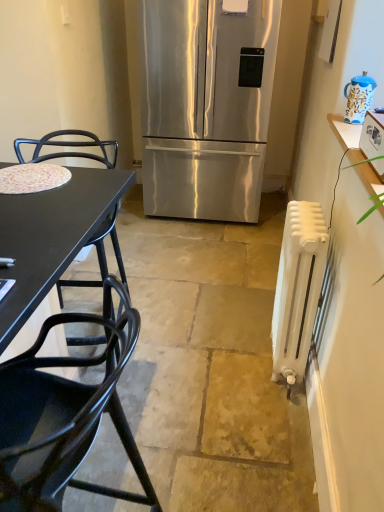
Question: Is white plastic toaster at upper right smaller than stainless steel refrigerator at center?

Choices:
 (A) yes
 (B) no

Answer: (A)

Question: Is there a large distance between white plastic toaster at upper right and stainless steel refrigerator at center?

Choices:
 (A) yes
 (B) no

Answer: (A)

Question: From the image's perspective, is white plastic toaster at upper right beneath stainless steel refrigerator at center?

Choices:
 (A) no
 (B) yes

Answer: (B)

Question: Is white plastic toaster at upper right next to stainless steel refrigerator at center?

Choices:
 (A) no
 (B) yes

Answer: (A)

Question: From a real-world perspective, is white plastic toaster at upper right positioned under stainless steel refrigerator at center based on gravity?

Choices:
 (A) no
 (B) yes

Answer: (A)

Question: Does white plastic toaster at upper right turn towards stainless steel refrigerator at center?

Choices:
 (A) yes
 (B) no

Answer: (B)

Question: Does white matte radiator at right lie behind stainless steel refrigerator at center?

Choices:
 (A) yes
 (B) no

Answer: (B)

Question: Considering the relative sizes of white matte radiator at right and stainless steel refrigerator at center in the image provided, is white matte radiator at right bigger than stainless steel refrigerator at center?

Choices:
 (A) yes
 (B) no

Answer: (B)

Question: Considering the relative positions of white matte radiator at right and stainless steel refrigerator at center in the image provided, is white matte radiator at right to the right of stainless steel refrigerator at center from the viewer's perspective?

Choices:
 (A) yes
 (B) no

Answer: (A)

Question: From a real-world perspective, is white matte radiator at right physically above stainless steel refrigerator at center?

Choices:
 (A) no
 (B) yes

Answer: (A)

Question: Does white matte radiator at right come in front of stainless steel refrigerator at center?

Choices:
 (A) no
 (B) yes

Answer: (B)

Question: Would you say white matte radiator at right contains stainless steel refrigerator at center?

Choices:
 (A) no
 (B) yes

Answer: (A)

Question: From a real-world perspective, is stainless steel refrigerator at center physically above blue and white ceramic teapot at upper right?

Choices:
 (A) no
 (B) yes

Answer: (A)